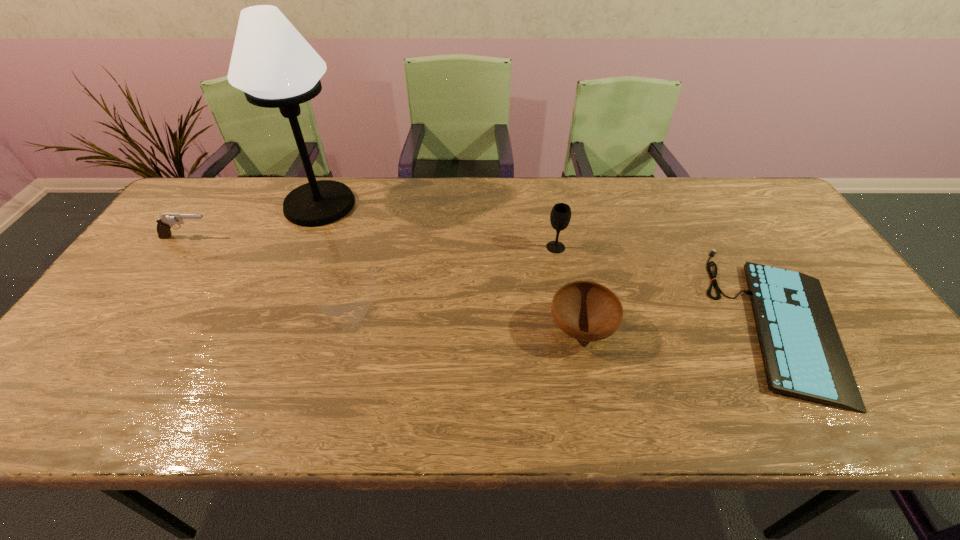
I want to click on the tallest object, so click(275, 67).

Locate an element on the screen. The width and height of the screenshot is (960, 540). the farthest object is located at coordinates (275, 67).

Where is `the second tallest object`? The width and height of the screenshot is (960, 540). the second tallest object is located at coordinates (560, 216).

This screenshot has width=960, height=540. Identify the location of the fourth nearest object. (166, 221).

Find the location of a particular element. gun is located at coordinates (166, 221).

Locate an element on the screen. The height and width of the screenshot is (540, 960). bowl is located at coordinates (587, 311).

At what (x,y) coordinates should I click in order to perform the action: click on computer keyboard. Please return your answer as a coordinate pair (x, y). Looking at the image, I should click on (803, 356).

Find the location of a particular element. Image resolution: width=960 pixels, height=540 pixels. the shortest object is located at coordinates (803, 356).

You are a GUI agent. You are given a task and a screenshot of the screen. Output one action in this format:
    pyautogui.click(x=<x>, y=<y>)
    Task: Click on the vacant space situated on the right of the table lamp
    Image resolution: width=960 pixels, height=540 pixels.
    Given the screenshot: What is the action you would take?
    pyautogui.click(x=416, y=205)

At what (x,y) coordinates should I click in order to perform the action: click on free space located on the left of the wineglass. Please return your answer as a coordinate pair (x, y). This screenshot has height=540, width=960. Looking at the image, I should click on (518, 247).